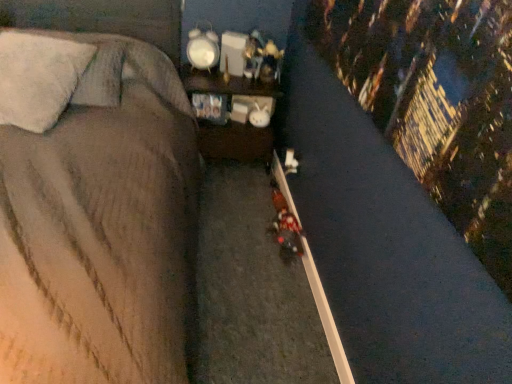
Question: Can you confirm if soft gray fabric bed at center is smaller than white fluffy pillow at upper left?

Choices:
 (A) no
 (B) yes

Answer: (A)

Question: Would you say soft gray fabric bed at center is outside white fluffy pillow at upper left?

Choices:
 (A) yes
 (B) no

Answer: (A)

Question: From a real-world perspective, is soft gray fabric bed at center physically below white fluffy pillow at upper left?

Choices:
 (A) no
 (B) yes

Answer: (B)

Question: Is soft gray fabric bed at center taller than white fluffy pillow at upper left?

Choices:
 (A) yes
 (B) no

Answer: (A)

Question: Considering the relative positions of soft gray fabric bed at center and white fluffy pillow at upper left in the image provided, is soft gray fabric bed at center behind white fluffy pillow at upper left?

Choices:
 (A) yes
 (B) no

Answer: (B)

Question: From a real-world perspective, is wooden shelf at center positioned above or below white fluffy pillow at upper left?

Choices:
 (A) above
 (B) below

Answer: (B)

Question: Considering the positions of wooden shelf at center and white fluffy pillow at upper left in the image, is wooden shelf at center wider or thinner than white fluffy pillow at upper left?

Choices:
 (A) wide
 (B) thin

Answer: (B)

Question: Does point (245, 89) appear closer or farther from the camera than point (44, 82)?

Choices:
 (A) farther
 (B) closer

Answer: (A)

Question: Would you say wooden shelf at center is to the left or to the right of white fluffy pillow at upper left in the picture?

Choices:
 (A) right
 (B) left

Answer: (A)

Question: Is wooden shelf at center taller or shorter than soft gray fabric bed at center?

Choices:
 (A) short
 (B) tall

Answer: (A)

Question: Is wooden shelf at center wider or thinner than soft gray fabric bed at center?

Choices:
 (A) thin
 (B) wide

Answer: (A)

Question: From the image's perspective, is wooden shelf at center above or below soft gray fabric bed at center?

Choices:
 (A) above
 (B) below

Answer: (A)

Question: Visually, is wooden shelf at center positioned to the left or to the right of soft gray fabric bed at center?

Choices:
 (A) left
 (B) right

Answer: (B)

Question: From the image's perspective, is shiny plastic toy at center above or below soft gray fabric bed at center?

Choices:
 (A) below
 (B) above

Answer: (B)

Question: Considering the positions of shiny plastic toy at center and soft gray fabric bed at center in the image, is shiny plastic toy at center taller or shorter than soft gray fabric bed at center?

Choices:
 (A) short
 (B) tall

Answer: (A)